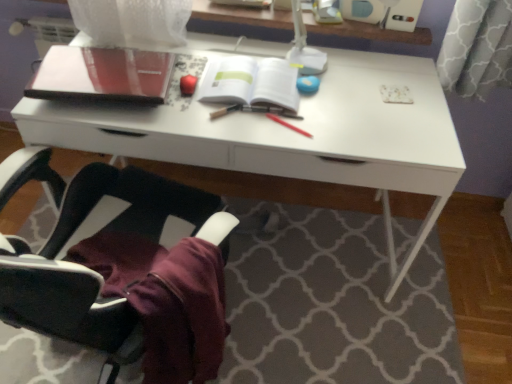
You are a GUI agent. You are given a task and a screenshot of the screen. Output one action in this format:
    pyautogui.click(x=<x>, y=<y>)
    Task: Click on the free spot to the right of glossy red apple at upper center, marked as the third stationery in a right-to-left arrangement
    
    Given the screenshot: What is the action you would take?
    pyautogui.click(x=238, y=109)